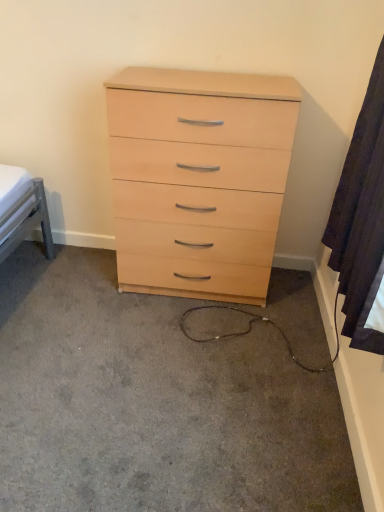
I want to click on vacant region to the left of light wood/veneer chest of drawers at center, so click(x=74, y=287).